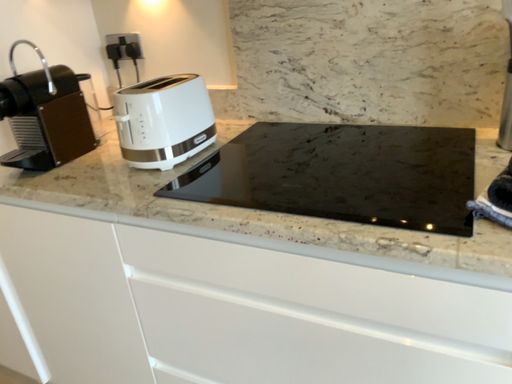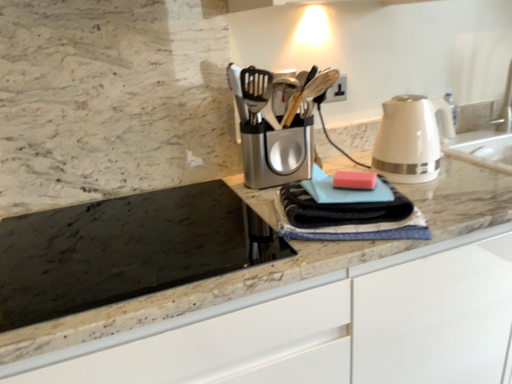
Question: Which way did the camera rotate in the video?

Choices:
 (A) rotated right
 (B) rotated left

Answer: (A)